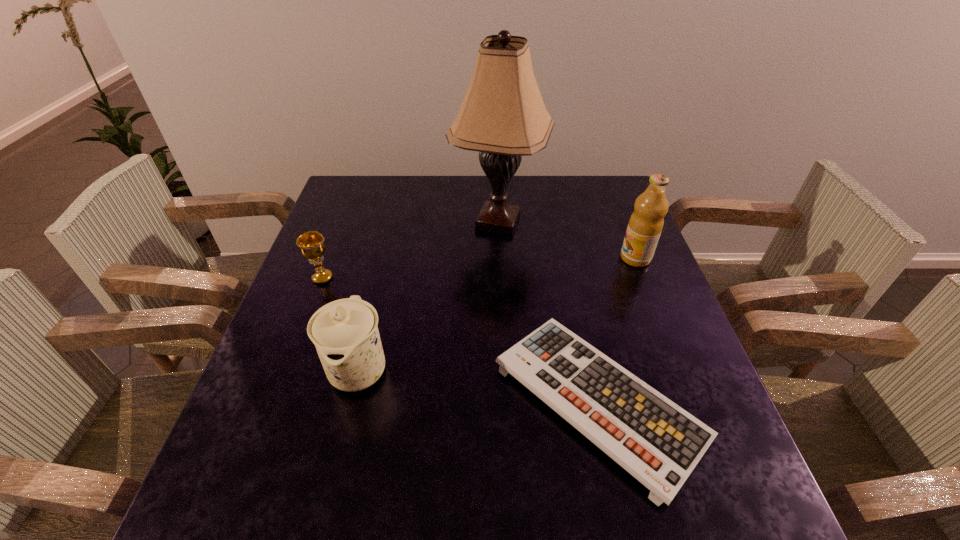
Identify the location of free spot located on the label of the fourth shortest object. The image size is (960, 540). (557, 258).

Find the location of a particular element. free space located on the spout of the second object from left to right is located at coordinates pyautogui.click(x=343, y=438).

Find the location of a particular element. vacant space located on the front of the chalice is located at coordinates (286, 374).

The image size is (960, 540). Identify the location of free space located 0.300m on the back of the shortest object. (564, 241).

You are a GUI agent. You are given a task and a screenshot of the screen. Output one action in this format:
    pyautogui.click(x=<x>, y=<y>)
    Task: Click on the object present at the far edge
    
    Given the screenshot: What is the action you would take?
    pyautogui.click(x=503, y=117)

Where is `object situated at the near edge`? This screenshot has width=960, height=540. object situated at the near edge is located at coordinates (659, 443).

The height and width of the screenshot is (540, 960). What are the coordinates of `chinaware present at the left edge` in the screenshot? It's located at (345, 333).

Identify the location of chalice at the left edge. The height and width of the screenshot is (540, 960). (312, 246).

Locate an element on the screen. This screenshot has height=540, width=960. olive oil that is at the right edge is located at coordinates (646, 223).

Image resolution: width=960 pixels, height=540 pixels. In order to click on computer keyboard present at the right edge in this screenshot , I will do `click(659, 443)`.